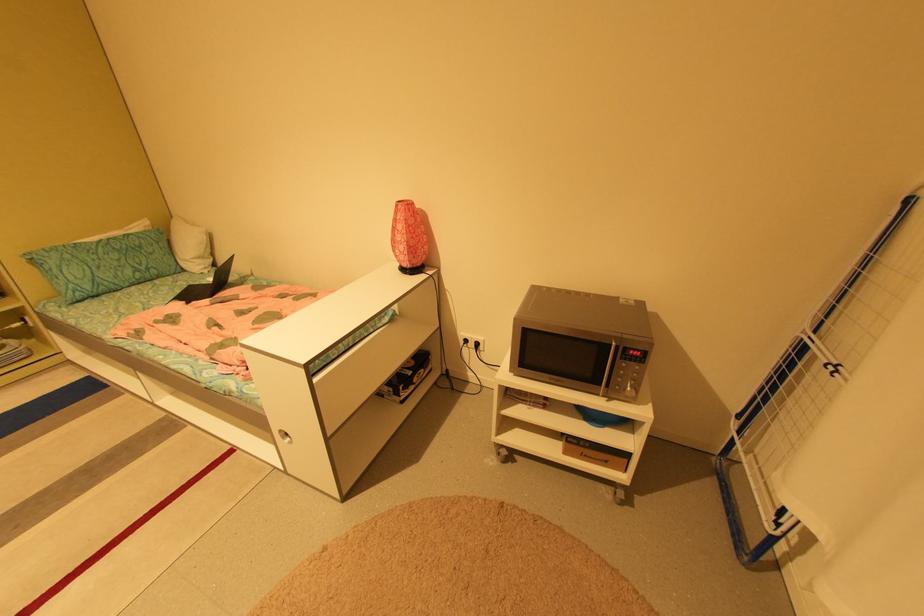
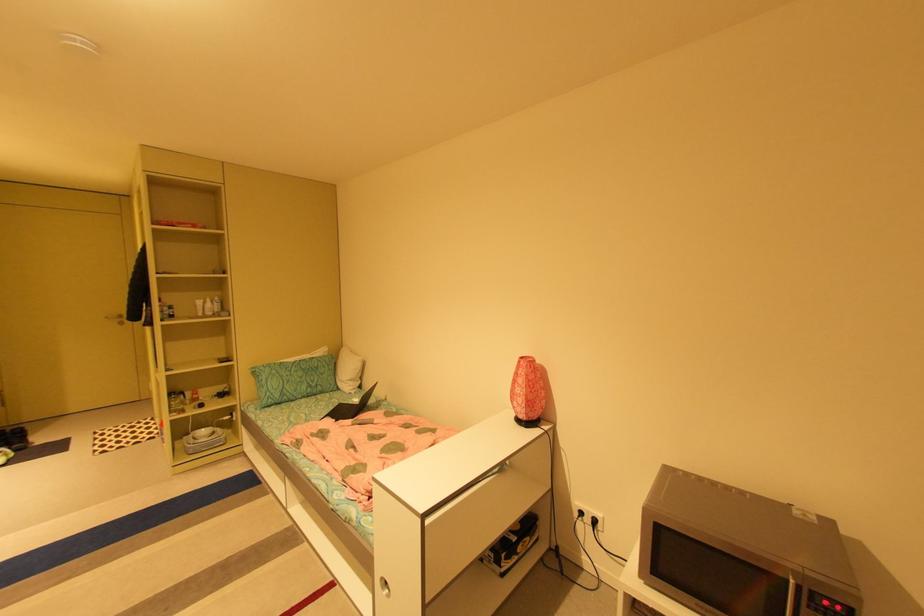
Question: In a continuous first-person perspective shot, in which direction is the camera moving?

Choices:
 (A) Left
 (B) Right
 (C) Forward
 (D) Backward

Answer: (D)